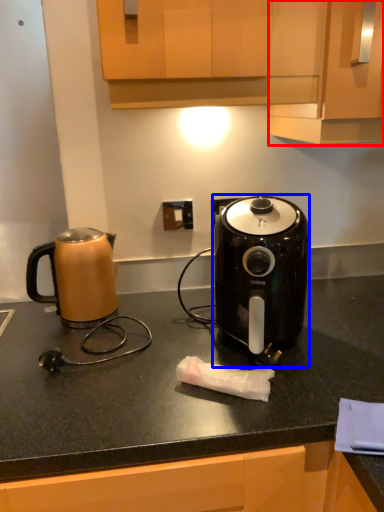
Question: Which point is further to the camera, cabinetry (highlighted by a red box) or toaster (highlighted by a blue box)?

Choices:
 (A) cabinetry
 (B) toaster

Answer: (B)